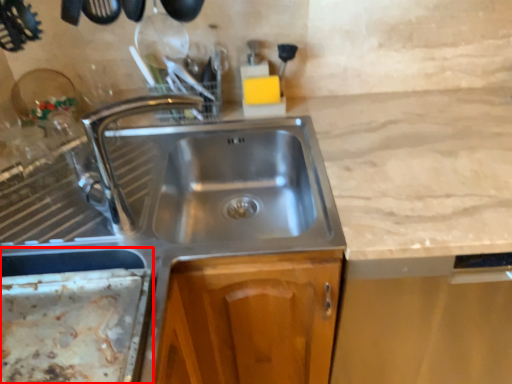
Question: Where is appliance (annotated by the red box) located in relation to tap in the image?

Choices:
 (A) right
 (B) left

Answer: (B)